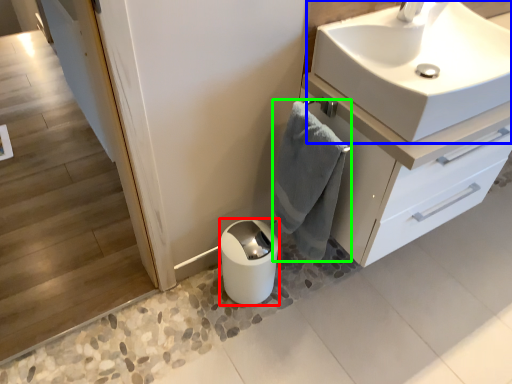
Question: Based on their relative distances, which object is nearer to toilet paper (highlighted by a red box)? Choose from sink (highlighted by a blue box) and bath towel (highlighted by a green box).

Choices:
 (A) sink
 (B) bath towel

Answer: (B)